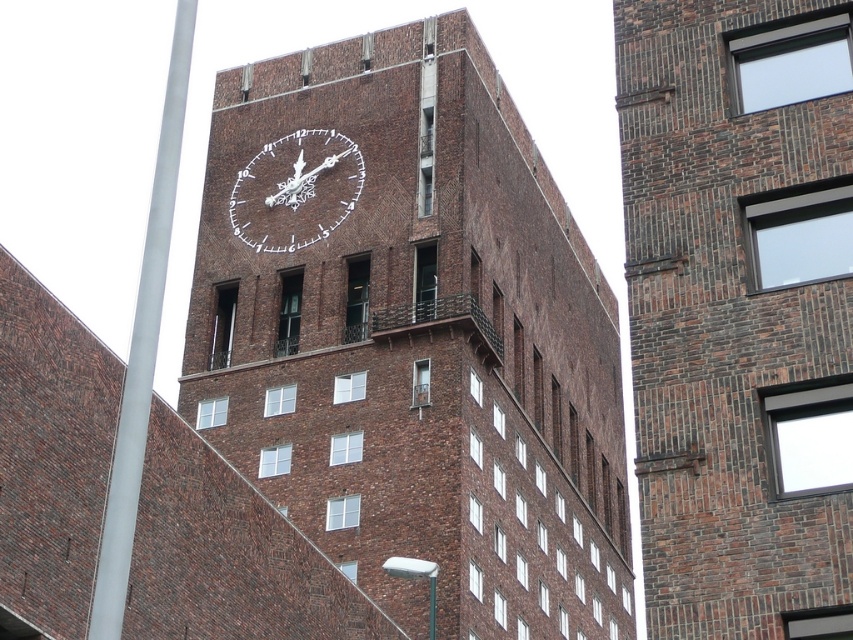
You are a city planner assessing the architectural elements of the brick building. You notice the smooth metallic pole at left and the metallic silver clock at center. Which of these two objects has a larger size?

The smooth metallic pole at left is bigger than the metallic silver clock at center.

You are an architect assessing the structural integrity of the buildings in the image. You notice the brown brick clock tower at center and the brown brick building at upper center. Which of these two structures has a greater width?

The brown brick clock tower at center has a greater width than the brown brick building at upper center according to the description.

You are standing in front of the brown brick clock tower at center and the brown brick building at upper center. Which structure is located more to the left?

The brown brick clock tower at center is positioned on the left side of the brown brick building at upper center, so it is more to the left.